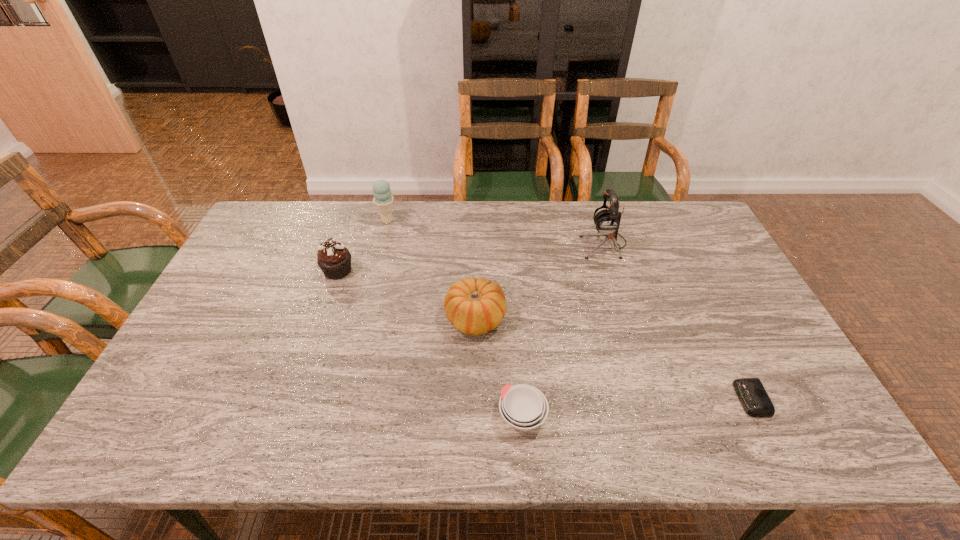
You are a GUI agent. You are given a task and a screenshot of the screen. Output one action in this format:
    pyautogui.click(x=<x>, y=<y>)
    Task: Click on the empty space that is in between the fifth object from left to right and the leftmost object
    
    Given the screenshot: What is the action you would take?
    pyautogui.click(x=471, y=257)

Locate which object is the fourth closest to the cupcake. Please provide its 2D coordinates. Your answer should be formatted as a tuple, i.e. [(x, y)], where the tuple contains the x and y coordinates of a point satisfying the conditions above.

[(607, 221)]

Where is `object that is the closest to the rightmost object`? object that is the closest to the rightmost object is located at coordinates (524, 407).

Where is `free region that satisfies the following two spatial constraints: 1. on the front side of the fifth tallest object; 2. on the left side of the farthest object`? free region that satisfies the following two spatial constraints: 1. on the front side of the fifth tallest object; 2. on the left side of the farthest object is located at coordinates (338, 416).

Locate an element on the screen. The width and height of the screenshot is (960, 540). free location that satisfies the following two spatial constraints: 1. on the display of the alarm clock; 2. on the front side of the second shortest object is located at coordinates (759, 416).

Find the location of a particular element. free point that satisfies the following two spatial constraints: 1. on the front side of the soup bowl; 2. on the right side of the fifth object from right to left is located at coordinates (338, 416).

This screenshot has height=540, width=960. Identify the location of free space that satisfies the following two spatial constraints: 1. on the front side of the fifth object from left to right; 2. on the right side of the second tallest object. (381, 244).